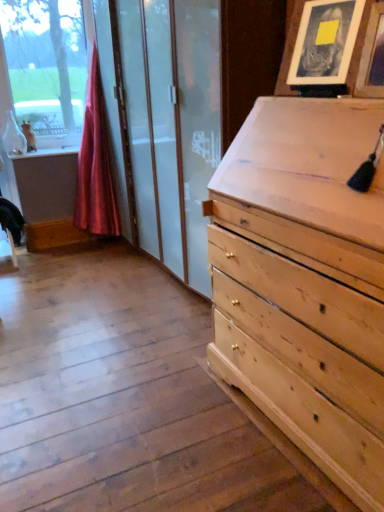
The height and width of the screenshot is (512, 384). Find the location of `wooden picture frame at upper right, which is the first picture frame from front to back`. wooden picture frame at upper right, which is the first picture frame from front to back is located at coordinates (372, 57).

This screenshot has height=512, width=384. Identify the location of matte wooden picture frame at upper right, which appears as the first picture frame when viewed from the back. (325, 42).

From a real-world perspective, is wooden picture frame at upper right, which is the first picture frame from front to back, above or below matte wooden picture frame at upper right, which appears as the 2th picture frame when viewed from the front?

In terms of real-world spatial position, wooden picture frame at upper right, which is the first picture frame from front to back, is below matte wooden picture frame at upper right, which appears as the 2th picture frame when viewed from the front.

Locate an element on the screen. picture frame that is above the wooden picture frame at upper right, which is the first picture frame from front to back (from the image's perspective) is located at coordinates (325, 42).

Does wooden picture frame at upper right, which is the first picture frame from front to back, lie behind matte wooden picture frame at upper right, which appears as the 2th picture frame when viewed from the front?

No, wooden picture frame at upper right, which is the first picture frame from front to back, is closer to the viewer.

From the image's perspective, which is below, wooden picture frame at upper right, which is the first picture frame from front to back, or matte wooden picture frame at upper right, which appears as the first picture frame when viewed from the back?

wooden picture frame at upper right, which is the first picture frame from front to back.

Considering the relative positions of wooden picture frame at upper right, the second picture frame positioned from the back, and silky red curtain at left in the image provided, is wooden picture frame at upper right, the second picture frame positioned from the back, to the right of silky red curtain at left from the viewer's perspective?

Indeed, wooden picture frame at upper right, the second picture frame positioned from the back, is positioned on the right side of silky red curtain at left.

From the image's perspective, who appears lower, wooden picture frame at upper right, which is the first picture frame from front to back, or silky red curtain at left?

From the image's view, wooden picture frame at upper right, which is the first picture frame from front to back, is below.

What's the angular difference between wooden picture frame at upper right, the second picture frame positioned from the back, and silky red curtain at left's facing directions?

The angular difference between wooden picture frame at upper right, the second picture frame positioned from the back, and silky red curtain at left is 86.7 degrees.

From a real-world perspective, which object stands above the other?

wooden picture frame at upper right, which is the first picture frame from front to back.

Does point (301, 40) come closer to viewer compared to point (79, 162)?

That is True.

How many degrees apart are the facing directions of matte wooden picture frame at upper right, which appears as the first picture frame when viewed from the back, and silky red curtain at left?

The angular difference between matte wooden picture frame at upper right, which appears as the first picture frame when viewed from the back, and silky red curtain at left is 75.9 degrees.

From the image's perspective, would you say matte wooden picture frame at upper right, which appears as the first picture frame when viewed from the back, is positioned over silky red curtain at left?

No.

Who is shorter, matte wooden picture frame at upper right, which appears as the first picture frame when viewed from the back, or silky red curtain at left?

matte wooden picture frame at upper right, which appears as the first picture frame when viewed from the back, is shorter.

Considering the sizes of objects silky red curtain at left and matte wooden picture frame at upper right, which appears as the first picture frame when viewed from the back, in the image provided, who is smaller, silky red curtain at left or matte wooden picture frame at upper right, which appears as the first picture frame when viewed from the back,?

With smaller size is matte wooden picture frame at upper right, which appears as the first picture frame when viewed from the back.

Considering the positions of point (118, 220) and point (358, 13), is point (118, 220) closer or farther from the camera than point (358, 13)?

Clearly, point (118, 220) is more distant from the camera than point (358, 13).

Are silky red curtain at left and matte wooden picture frame at upper right, which appears as the first picture frame when viewed from the back, far apart?

That's right, there is a large distance between silky red curtain at left and matte wooden picture frame at upper right, which appears as the first picture frame when viewed from the back.

Could you measure the distance between silky red curtain at left and matte wooden picture frame at upper right, which appears as the first picture frame when viewed from the back?

silky red curtain at left is 7.17 feet away from matte wooden picture frame at upper right, which appears as the first picture frame when viewed from the back.

Is silky red curtain at left positioned beyond the bounds of wooden picture frame at upper right, the second picture frame positioned from the back?

Indeed, silky red curtain at left is completely outside wooden picture frame at upper right, the second picture frame positioned from the back.

Is silky red curtain at left aimed at wooden picture frame at upper right, which is the first picture frame from front to back?

Yes, silky red curtain at left is oriented towards wooden picture frame at upper right, which is the first picture frame from front to back.

Does point (84, 227) come farther from viewer compared to point (382, 13)?

Yes, it is behind point (382, 13).

From the image's perspective, which is above, matte wooden picture frame at upper right, which appears as the first picture frame when viewed from the back, or wooden picture frame at upper right, the second picture frame positioned from the back?

matte wooden picture frame at upper right, which appears as the first picture frame when viewed from the back, appears higher in the image.

Between matte wooden picture frame at upper right, which appears as the 2th picture frame when viewed from the front, and wooden picture frame at upper right, the second picture frame positioned from the back, which one has smaller width?

Thinner between the two is wooden picture frame at upper right, the second picture frame positioned from the back.

Is matte wooden picture frame at upper right, which appears as the 2th picture frame when viewed from the front, far from wooden picture frame at upper right, the second picture frame positioned from the back?

No, matte wooden picture frame at upper right, which appears as the 2th picture frame when viewed from the front, is in close proximity to wooden picture frame at upper right, the second picture frame positioned from the back.

The image size is (384, 512). Identify the location of picture frame that appears on the right of matte wooden picture frame at upper right, which appears as the 2th picture frame when viewed from the front. (372, 57).

From the image's perspective, starting from the silky red curtain at left, which picture frame is the 2nd one below? Please provide its 2D coordinates.

[(372, 57)]

Looking at the image, which one is located further to matte wooden picture frame at upper right, which appears as the 2th picture frame when viewed from the front, wooden picture frame at upper right, which is the first picture frame from front to back, or silky red curtain at left?

Based on the image, silky red curtain at left appears to be further to matte wooden picture frame at upper right, which appears as the 2th picture frame when viewed from the front.

From the image, which object appears to be nearer to wooden picture frame at upper right, which is the first picture frame from front to back, matte wooden picture frame at upper right, which appears as the 2th picture frame when viewed from the front, or silky red curtain at left?

The object closer to wooden picture frame at upper right, which is the first picture frame from front to back, is matte wooden picture frame at upper right, which appears as the 2th picture frame when viewed from the front.

From the picture: Based on their spatial positions, is silky red curtain at left or wooden picture frame at upper right, which is the first picture frame from front to back, further from matte wooden picture frame at upper right, which appears as the 2th picture frame when viewed from the front?

silky red curtain at left.

In the scene shown: Based on their spatial positions, is wooden picture frame at upper right, the second picture frame positioned from the back, or matte wooden picture frame at upper right, which appears as the first picture frame when viewed from the back, closer to silky red curtain at left?

Among the two, matte wooden picture frame at upper right, which appears as the first picture frame when viewed from the back, is located nearer to silky red curtain at left.

In the scene shown: Considering their positions, is silky red curtain at left positioned further to wooden picture frame at upper right, which is the first picture frame from front to back, than matte wooden picture frame at upper right, which appears as the first picture frame when viewed from the back?

silky red curtain at left.

Considering their positions, is matte wooden picture frame at upper right, which appears as the 2th picture frame when viewed from the front, positioned further to silky red curtain at left than wooden picture frame at upper right, the second picture frame positioned from the back?

Based on the image, wooden picture frame at upper right, the second picture frame positioned from the back, appears to be further to silky red curtain at left.

You are a GUI agent. You are given a task and a screenshot of the screen. Output one action in this format:
    pyautogui.click(x=<x>, y=<y>)
    Task: Click on the picture frame positioned between wooden picture frame at upper right, the second picture frame positioned from the back, and silky red curtain at left from near to far
    Image resolution: width=384 pixels, height=512 pixels.
    Given the screenshot: What is the action you would take?
    pyautogui.click(x=325, y=42)